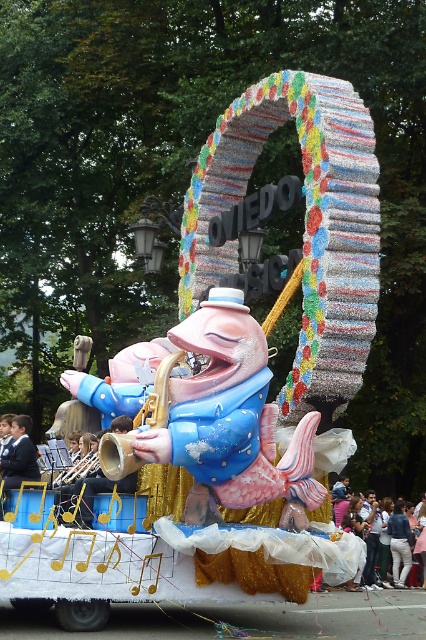
Can you confirm if light blue fabric at lower right is positioned to the left of gold shiny trumpet at center?

No, light blue fabric at lower right is not to the left of gold shiny trumpet at center.

Between point (348, 508) and point (121, 484), which one is positioned behind?

The point (348, 508) is behind.

Image resolution: width=426 pixels, height=640 pixels. What do you see at coordinates (370, 531) in the screenshot? I see `light blue fabric at lower right` at bounding box center [370, 531].

At what (x,y) coordinates should I click in order to perform the action: click on light blue fabric at lower right. Please return your answer as a coordinate pair (x, y). Looking at the image, I should click on (370, 531).

Which is more to the right, blue fabric suit at center or blue jeans at lower right?

From the viewer's perspective, blue jeans at lower right appears more on the right side.

Where is `blue fabric suit at center`? The height and width of the screenshot is (640, 426). blue fabric suit at center is located at coordinates (20, 456).

Does point (388, 554) come in front of point (365, 577)?

No, it is not.

Locate an element on the screen. light blue fabric at lower right is located at coordinates (370, 531).

Locate an element on the screen. light blue fabric at lower right is located at coordinates (370, 531).